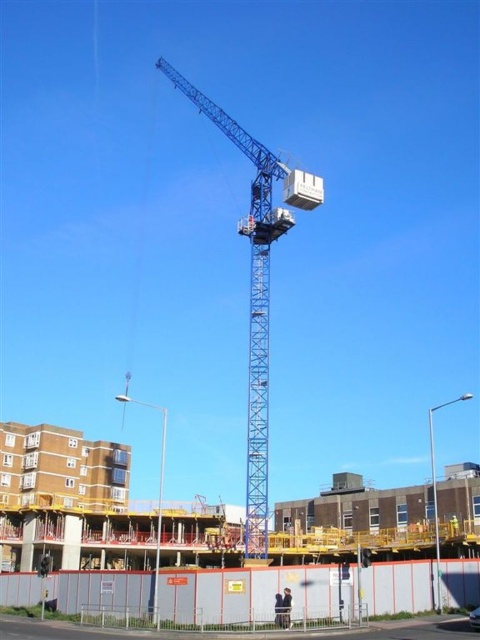
Is blue metallic crane at center positioned in front of white plastic lift at upper center?

That is True.

Is blue metallic crane at center further to camera compared to white plastic lift at upper center?

No, blue metallic crane at center is closer to the viewer.

Who is more distant from viewer, (273, 177) or (301, 189)?

The point (273, 177) is behind.

Locate an element on the screen. The width and height of the screenshot is (480, 640). blue metallic crane at center is located at coordinates coord(252,300).